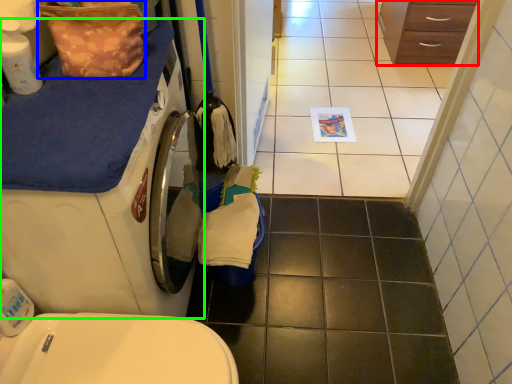
Question: Based on their relative distances, which object is farther from chest of drawers (highlighted by a red box)? Choose from material (highlighted by a blue box) and washing machine (highlighted by a green box).

Choices:
 (A) material
 (B) washing machine

Answer: (B)